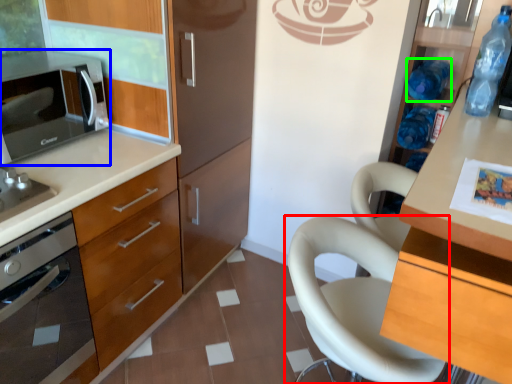
Question: Estimate the real-world distances between objects in this image. Which object is farther from chair (highlighted by a red box), microwave oven (highlighted by a blue box) or bottle (highlighted by a green box)?

Choices:
 (A) microwave oven
 (B) bottle

Answer: (A)